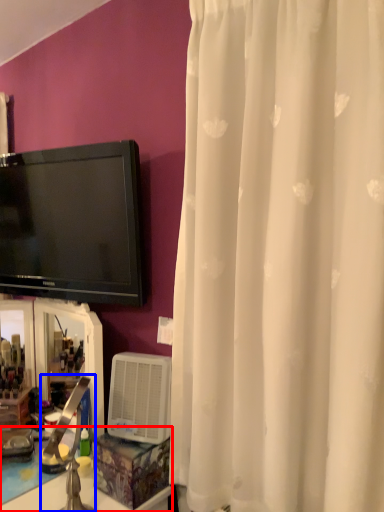
Question: Which of the following is the closest to the observer, counter top (highlighted by a red box) or faucet (highlighted by a blue box)?

Choices:
 (A) counter top
 (B) faucet

Answer: (B)